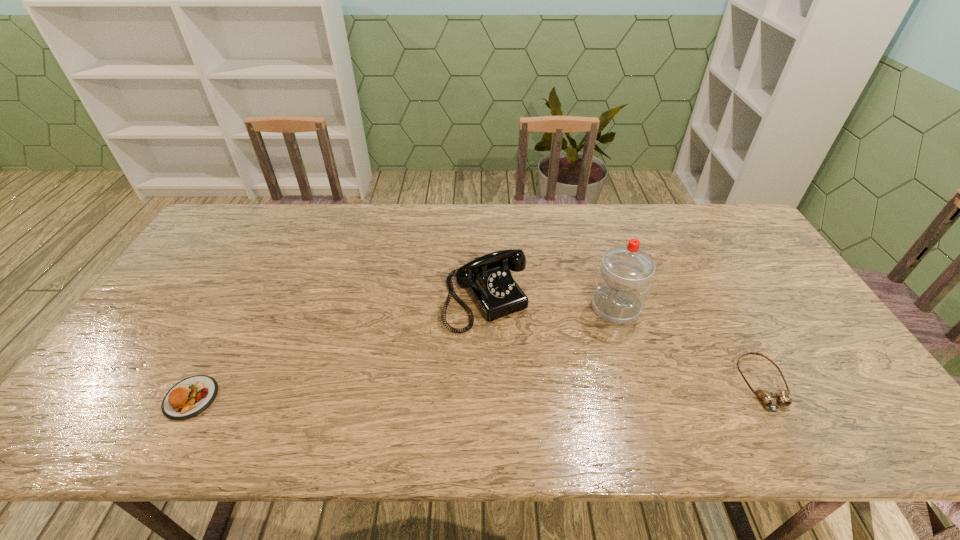
Locate an element on the screen. free space on the desktop that is between the leftmost object and the rightmost object and is positioned on the handle side of the tallest object is located at coordinates (x=544, y=389).

Find the location of a particular element. free space on the desktop that is between the second shortest object and the shortest object and is positioned on the dial of the second tallest object is located at coordinates (546, 389).